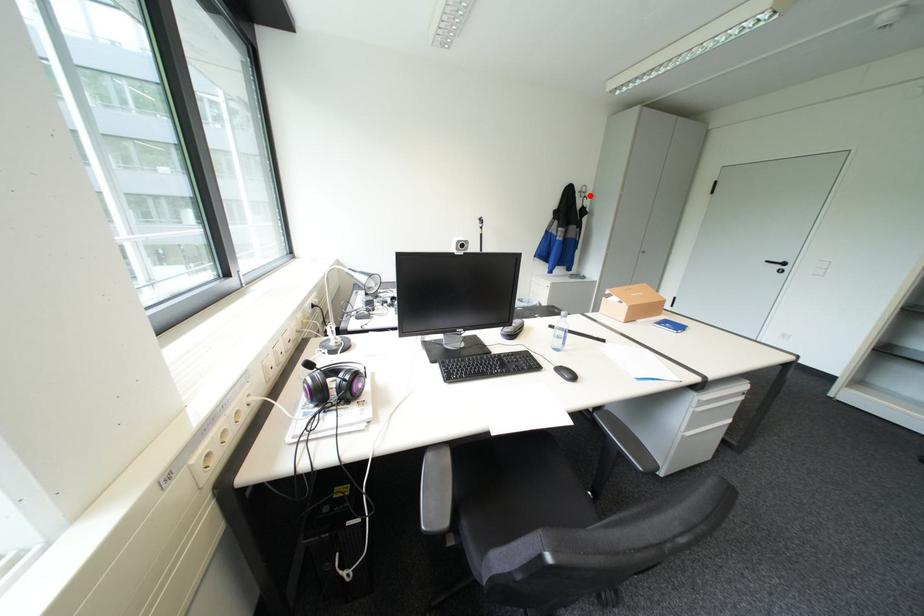
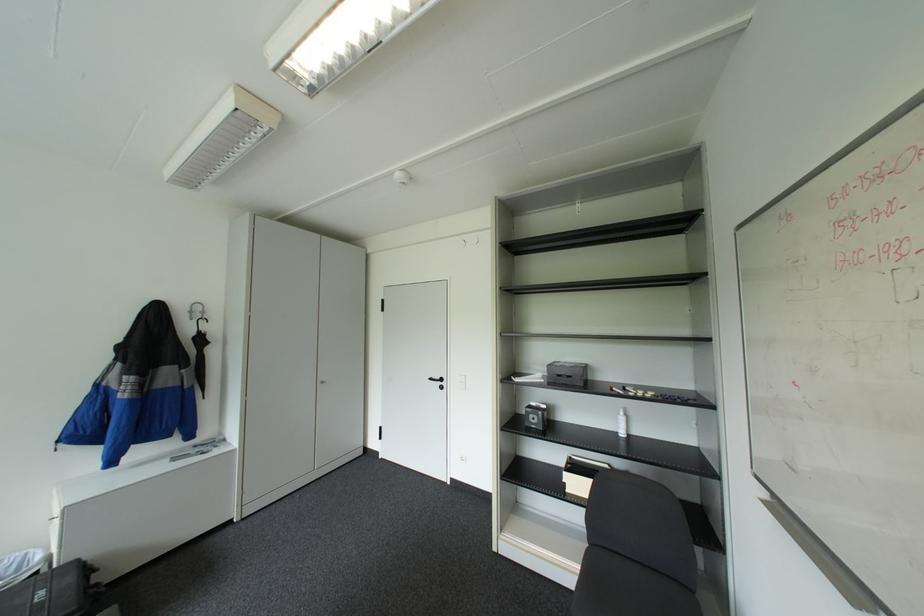
Question: I am providing you with two images of the same scene from different viewpoints. Image1 has a red point marked. In image2, the corresponding 3D location appears at what relative position? Reply with the corresponding letter.

Choices:
 (A) Closer
 (B) Farther

Answer: (B)